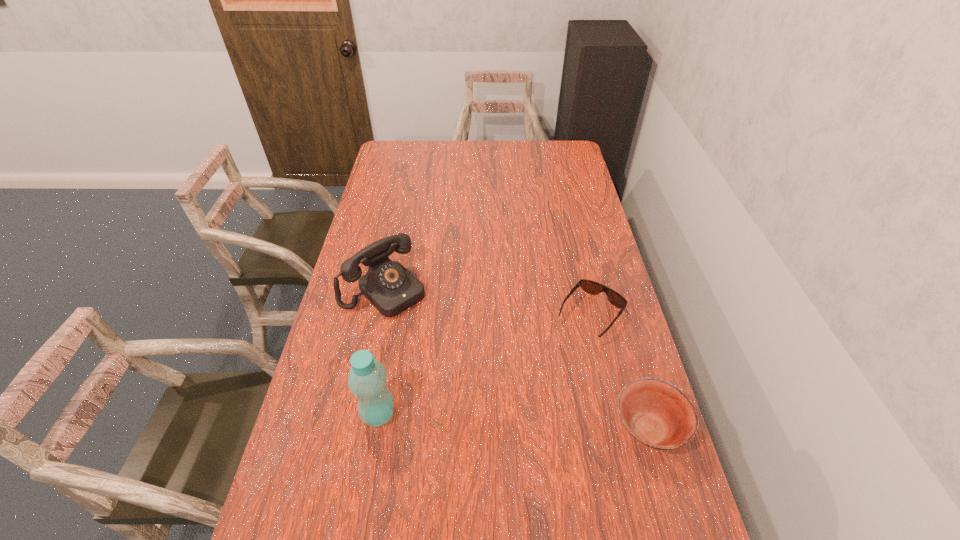
Find the location of a particular element. The width and height of the screenshot is (960, 540). bottle is located at coordinates (367, 379).

At what (x,y) coordinates should I click in order to perform the action: click on the second shortest object. Please return your answer as a coordinate pair (x, y). The image size is (960, 540). Looking at the image, I should click on (657, 414).

Locate an element on the screen. The width and height of the screenshot is (960, 540). telephone is located at coordinates (389, 286).

This screenshot has height=540, width=960. Identify the location of sunglasses. (591, 287).

I want to click on vacant region located on the back of the bottle, so click(x=395, y=321).

Where is `vacant area situated 0.340m on the left of the third tallest object`? This screenshot has width=960, height=540. vacant area situated 0.340m on the left of the third tallest object is located at coordinates (478, 430).

You are a GUI agent. You are given a task and a screenshot of the screen. Output one action in this format:
    pyautogui.click(x=<x>, y=<y>)
    Task: Click on the vacant area located on the dial of the telephone
    
    Given the screenshot: What is the action you would take?
    pyautogui.click(x=472, y=373)

In order to click on vacant region located 0.080m on the dial of the telephone in this screenshot , I will do `click(423, 325)`.

Where is `free location located 0.370m on the dial of the telephone`? The image size is (960, 540). free location located 0.370m on the dial of the telephone is located at coordinates (486, 387).

You are a GUI agent. You are given a task and a screenshot of the screen. Output one action in this format:
    pyautogui.click(x=<x>, y=<y>)
    Task: Click on the free spot located on the front-facing side of the sunglasses
    
    Given the screenshot: What is the action you would take?
    pyautogui.click(x=548, y=371)